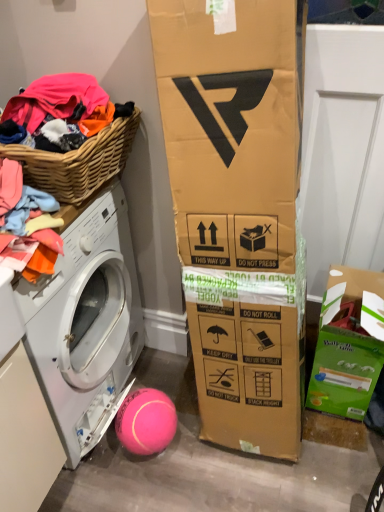
Question: Is pink rubber ball at lower center thinner than green cardboard box at lower right?

Choices:
 (A) no
 (B) yes

Answer: (B)

Question: From the image's perspective, is pink rubber ball at lower center on green cardboard box at lower right?

Choices:
 (A) yes
 (B) no

Answer: (B)

Question: Are pink rubber ball at lower center and green cardboard box at lower right beside each other?

Choices:
 (A) yes
 (B) no

Answer: (B)

Question: Considering the relative positions of pink rubber ball at lower center and green cardboard box at lower right in the image provided, is pink rubber ball at lower center in front of green cardboard box at lower right?

Choices:
 (A) yes
 (B) no

Answer: (B)

Question: Could green cardboard box at lower right be considered to be inside pink rubber ball at lower center?

Choices:
 (A) yes
 (B) no

Answer: (B)

Question: Considering the positions of point click(76, 368) and point click(89, 180), is point click(76, 368) closer or farther from the camera than point click(89, 180)?

Choices:
 (A) farther
 (B) closer

Answer: (A)

Question: Is white glossy washing machine at left inside the boundaries of woven wood basket at left, or outside?

Choices:
 (A) outside
 (B) inside

Answer: (A)

Question: From a real-world perspective, is white glossy washing machine at left physically located above or below woven wood basket at left?

Choices:
 (A) above
 (B) below

Answer: (B)

Question: In the image, is white glossy washing machine at left on the left side or the right side of woven wood basket at left?

Choices:
 (A) right
 (B) left

Answer: (B)

Question: Considering their positions, is woven wood basket at left located in front of or behind white glossy washing machine at left?

Choices:
 (A) front
 (B) behind

Answer: (A)

Question: Visually, is woven wood basket at left positioned to the left or to the right of white glossy washing machine at left?

Choices:
 (A) right
 (B) left

Answer: (A)

Question: Is point (107, 178) positioned closer to the camera than point (31, 344)?

Choices:
 (A) closer
 (B) farther

Answer: (B)

Question: In terms of size, does woven wood basket at left appear bigger or smaller than white glossy washing machine at left?

Choices:
 (A) small
 (B) big

Answer: (A)

Question: Is green cardboard box at lower right situated inside woven wood basket at left or outside?

Choices:
 (A) outside
 (B) inside

Answer: (A)

Question: From a real-world perspective, is green cardboard box at lower right physically located above or below woven wood basket at left?

Choices:
 (A) above
 (B) below

Answer: (B)